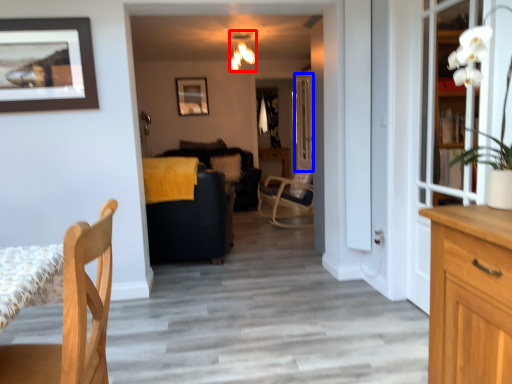
Question: Among these objects, which one is farthest to the camera, lamp (highlighted by a red box) or glass door (highlighted by a blue box)?

Choices:
 (A) lamp
 (B) glass door

Answer: (B)